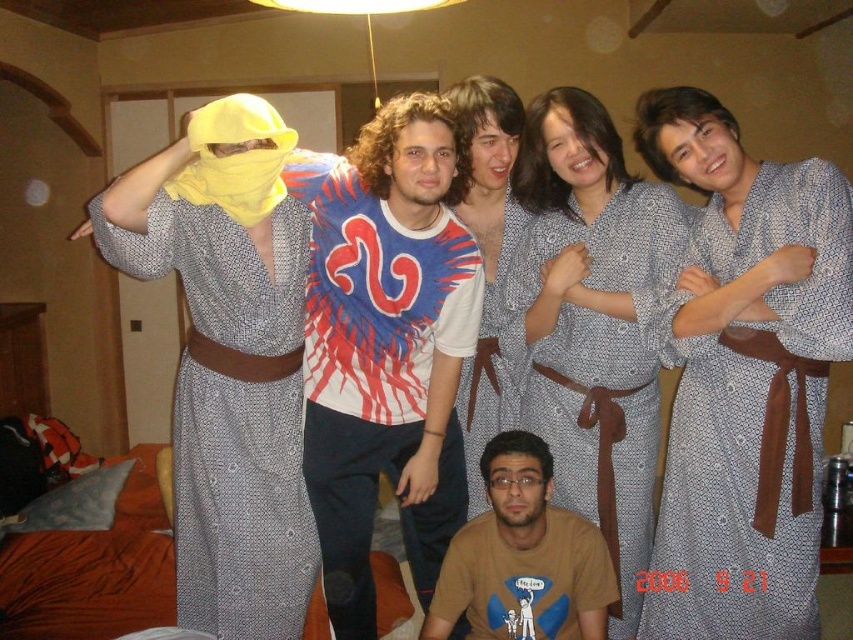
In the scene shown: You are organizing a themed event and need to arrange the gray textured robe at center and the textured gray robe at center in a display. According to the image, which robe should be placed to the right side for accuracy?

The gray textured robe at center should be placed to the right side of the textured gray robe at center.